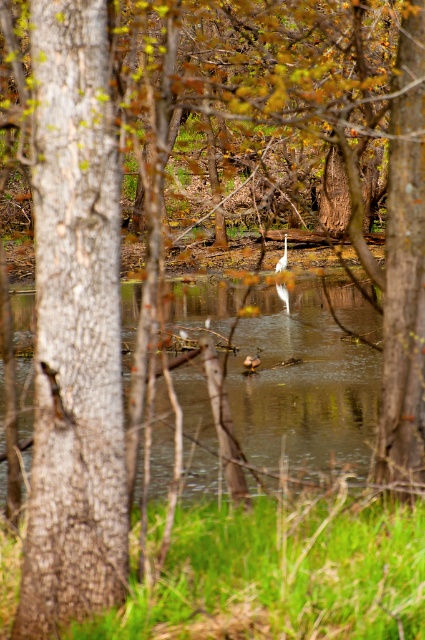
You are a photographer wanting to capture both the rough bark tree at left and the white matte bird at center in a single frame. Based on their positions, which object should you focus on first to ensure both are in the shot?

Since the rough bark tree at left is to the left of the white matte bird at center, you should focus on the rough bark tree at left first to ensure both are in the shot.

You are a photographer trying to capture the rough bark tree at left and the white matte bird at center in the same frame. Based on their sizes, which one should you focus on to ensure both are visible clearly?

The rough bark tree at left is larger than the white matte bird at center, so you should focus on the rough bark tree at left to ensure both are visible clearly.